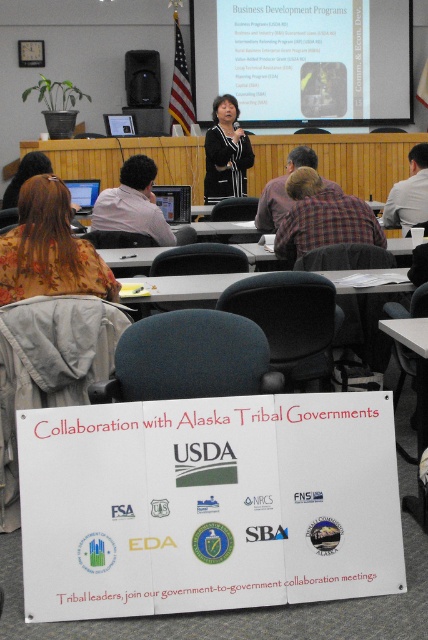
Question: Which point is farther to the camera?

Choices:
 (A) (359, 230)
 (B) (65, 202)
 (C) (270, 184)

Answer: (C)

Question: Considering the real-world distances, which object is farthest from the matte white projector screen at upper center?

Choices:
 (A) plaid fabric shirt at center
 (B) white shirt at upper right

Answer: (A)

Question: Does matte pink shirt at center have a greater width compared to white shirt at upper right?

Choices:
 (A) yes
 (B) no

Answer: (A)

Question: Can you confirm if matte white projector screen at upper center is bigger than matte pink shirt at center?

Choices:
 (A) yes
 (B) no

Answer: (A)

Question: Which point appears farthest from the camera in this image?

Choices:
 (A) (41, 259)
 (B) (326, 186)
 (C) (401, 205)

Answer: (C)

Question: Is white shirt at upper right below plaid shirt at center?

Choices:
 (A) yes
 (B) no

Answer: (B)